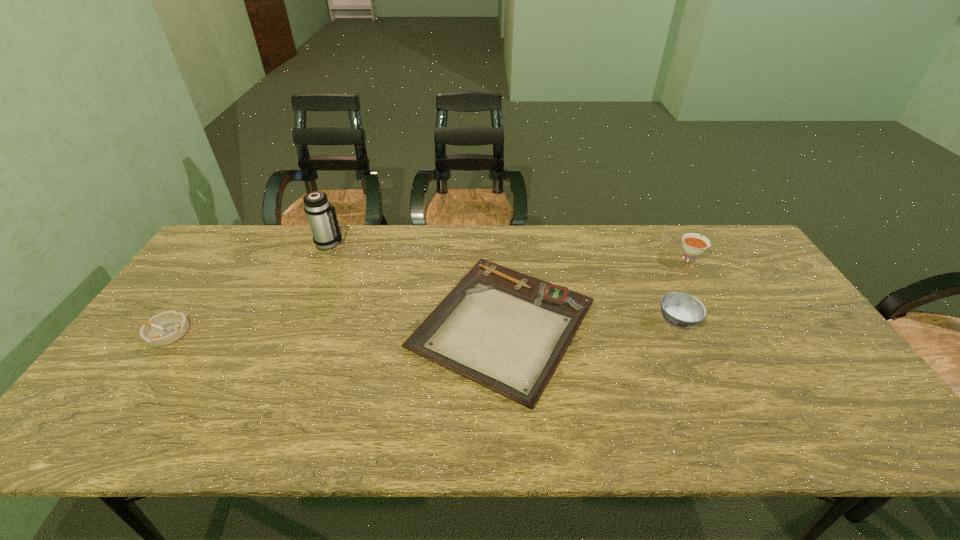
Find the location of `thermos bottle`. thermos bottle is located at coordinates pos(320,213).

At what (x,y) coordinates should I click in order to perform the action: click on the tallest object. Please return your answer as a coordinate pair (x, y). Looking at the image, I should click on (320, 213).

Where is `the rightmost object`? Image resolution: width=960 pixels, height=540 pixels. the rightmost object is located at coordinates (693, 244).

The width and height of the screenshot is (960, 540). In order to click on the second tallest object in this screenshot , I will do `click(693, 244)`.

Where is `the taller ashtray`? Image resolution: width=960 pixels, height=540 pixels. the taller ashtray is located at coordinates (682, 310).

Locate an element on the screen. the second object from right to left is located at coordinates (682, 310).

At what (x,y) coordinates should I click in order to perform the action: click on the fourth tallest object. Please return your answer as a coordinate pair (x, y). This screenshot has height=540, width=960. Looking at the image, I should click on click(167, 327).

Locate an element on the screen. This screenshot has height=540, width=960. the leftmost object is located at coordinates (167, 327).

Where is `the shortest object`? the shortest object is located at coordinates (507, 331).

At what (x,y) coordinates should I click in order to perform the action: click on the third object from right to left. Please return your answer as a coordinate pair (x, y). Looking at the image, I should click on (507, 331).